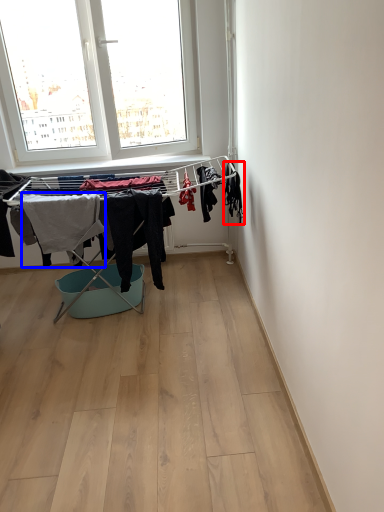
Question: Which object appears closest to the camera in this image, clothing (highlighted by a red box) or clothing (highlighted by a blue box)?

Choices:
 (A) clothing
 (B) clothing

Answer: (A)